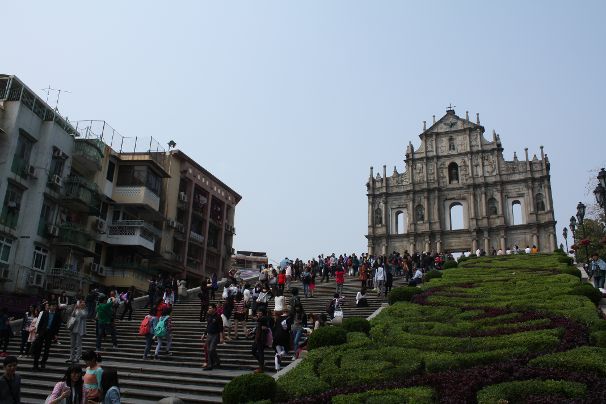
What are the coordinates of `ac` in the screenshot? It's located at (54, 182), (30, 169), (62, 153).